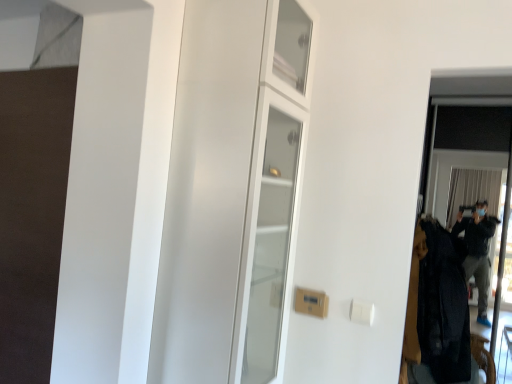
Question: Is transparent glass screen door at right oriented away from dark woolen coat at right?

Choices:
 (A) no
 (B) yes

Answer: (B)

Question: Does transparent glass screen door at right have a lesser height compared to dark woolen coat at right?

Choices:
 (A) no
 (B) yes

Answer: (A)

Question: Considering the relative sizes of transparent glass screen door at right and dark woolen coat at right in the image provided, is transparent glass screen door at right smaller than dark woolen coat at right?

Choices:
 (A) no
 (B) yes

Answer: (B)

Question: Can you confirm if transparent glass screen door at right is taller than dark woolen coat at right?

Choices:
 (A) no
 (B) yes

Answer: (B)

Question: Is transparent glass screen door at right not within dark woolen coat at right?

Choices:
 (A) no
 (B) yes

Answer: (B)

Question: From the image's perspective, relative to white glossy cabinet at center, is dark woolen coat at right above or below?

Choices:
 (A) above
 (B) below

Answer: (B)

Question: Is dark woolen coat at right wider or thinner than white glossy cabinet at center?

Choices:
 (A) thin
 (B) wide

Answer: (B)

Question: Is point click(x=459, y=372) positioned closer to the camera than point click(x=184, y=178)?

Choices:
 (A) closer
 (B) farther

Answer: (B)

Question: In terms of height, does dark woolen coat at right look taller or shorter compared to white glossy cabinet at center?

Choices:
 (A) tall
 (B) short

Answer: (B)

Question: Considering their positions, is white glossy cabinet at center located in front of or behind transparent glass screen door at right?

Choices:
 (A) behind
 (B) front

Answer: (B)

Question: Considering the positions of white glossy cabinet at center and transparent glass screen door at right in the image, is white glossy cabinet at center taller or shorter than transparent glass screen door at right?

Choices:
 (A) short
 (B) tall

Answer: (A)

Question: Considering the positions of white glossy cabinet at center and transparent glass screen door at right in the image, is white glossy cabinet at center bigger or smaller than transparent glass screen door at right?

Choices:
 (A) big
 (B) small

Answer: (A)

Question: In terms of width, does white glossy cabinet at center look wider or thinner when compared to transparent glass screen door at right?

Choices:
 (A) thin
 (B) wide

Answer: (B)

Question: In terms of size, does transparent glass screen door at right appear bigger or smaller than dark woolen coat at right?

Choices:
 (A) big
 (B) small

Answer: (B)

Question: From a real-world perspective, is transparent glass screen door at right positioned above or below dark woolen coat at right?

Choices:
 (A) below
 (B) above

Answer: (B)